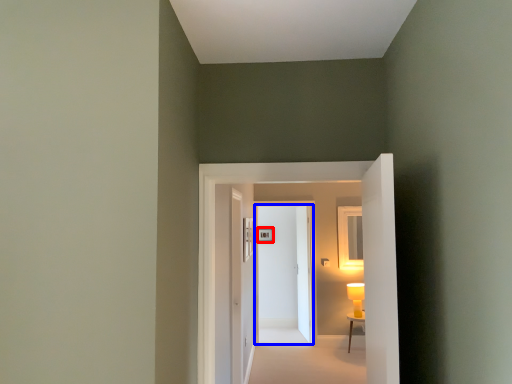
Question: Which object appears closest to the camera in this image, picture frame (highlighted by a red box) or door (highlighted by a blue box)?

Choices:
 (A) picture frame
 (B) door

Answer: (B)